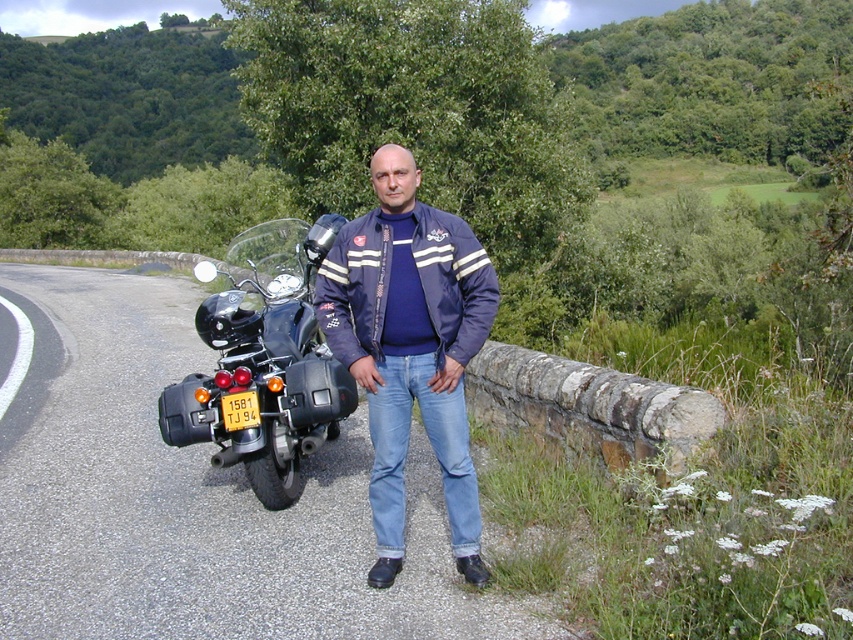
The width and height of the screenshot is (853, 640). Describe the element at coordinates (410, 346) in the screenshot. I see `navy blue jacket at center` at that location.

Is navy blue jacket at center to the left of black matte motorcycle at left from the viewer's perspective?

No, navy blue jacket at center is not to the left of black matte motorcycle at left.

Which is in front, point (375, 513) or point (300, 339)?

Point (375, 513) is in front.

Image resolution: width=853 pixels, height=640 pixels. Find the location of `navy blue jacket at center`. navy blue jacket at center is located at coordinates (410, 346).

Which is below, asphalt road at center or navy blue jacket at center?

asphalt road at center is below.

From the picture: Which is above, asphalt road at center or navy blue jacket at center?

navy blue jacket at center is above.

Between point (107, 563) and point (427, 256), which one is positioned behind?

Point (107, 563)

Identify the location of asphalt road at center. (196, 499).

Can you confirm if asphalt road at center is positioned below black matte motorcycle at left?

Correct, asphalt road at center is located below black matte motorcycle at left.

Is asphalt road at center closer to camera compared to black matte motorcycle at left?

Yes, asphalt road at center is in front of black matte motorcycle at left.

Is point (412, 579) positioned behind point (277, 444)?

No.

Locate an element on the screen. asphalt road at center is located at coordinates (196, 499).